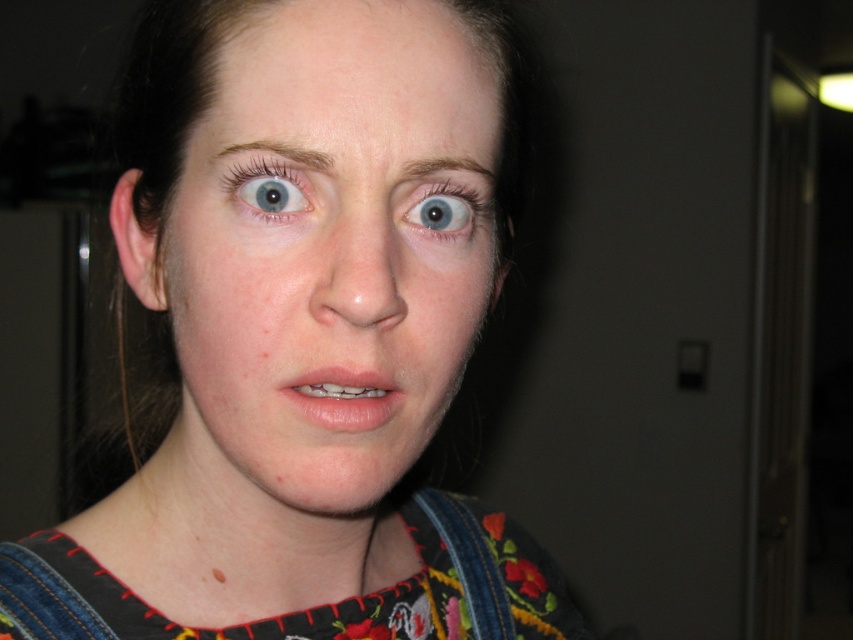
You are standing in a room and see the jeans at center. Based on their position, can you determine if they are placed closer to the left or right side of the room?

The jeans at center is located at point 0.533 on the x axis, which is closer to the right side of the room since 0.533 is more than 0.5.

You are a photographer adjusting the focus on your camera. You notice the smooth skin face at center and the blue glossy eye at center in your viewfinder. Which object should you focus on to ensure the face is properly captured in sharp detail?

The smooth skin face at center is closer to the viewer than the blue glossy eye at center. To ensure the face is properly captured in sharp detail, focus on the smooth skin face at center since it is closer and the primary subject.

You are holding a small 12 inch ruler and want to measure the distance from your eyes to the point at coordinates point (466, 36) in the image. Can you fit the entire ruler between your eyes and that point?

The distance between you and the point (466, 36) is 13.10 inches, so yes, the 12 inch ruler can fit between your eyes and the point since it is shorter than the distance.